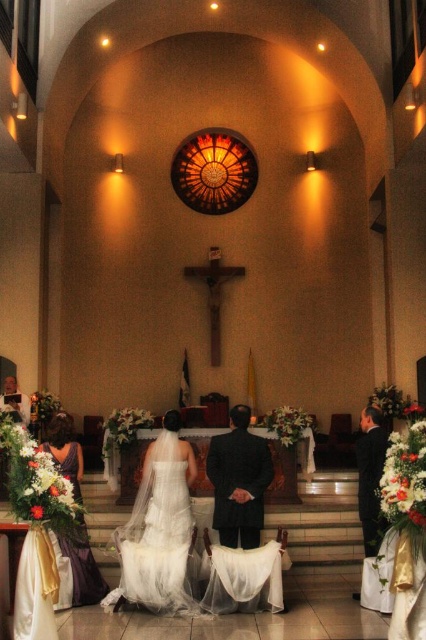
Question: Which object is positioned closest to the white satin dress at center?

Choices:
 (A) dark suit at center
 (B) smooth white shirt at lower left
 (C) dark suit at right

Answer: (A)

Question: In this image, where is dark suit at center located relative to satin purple dress at lower left?

Choices:
 (A) above
 (B) below

Answer: (A)

Question: Which point appears farthest from the camera in this image?

Choices:
 (A) click(229, 516)
 (B) click(71, 417)

Answer: (B)

Question: Is white satin dress at center above smooth white shirt at lower left?

Choices:
 (A) no
 (B) yes

Answer: (A)

Question: Is white satin dress at center thinner than smooth white shirt at lower left?

Choices:
 (A) yes
 (B) no

Answer: (B)

Question: Which point is farther from the camera taking this photo?

Choices:
 (A) (371, 444)
 (B) (11, 403)
 (C) (135, 572)
 (D) (89, 548)

Answer: (B)